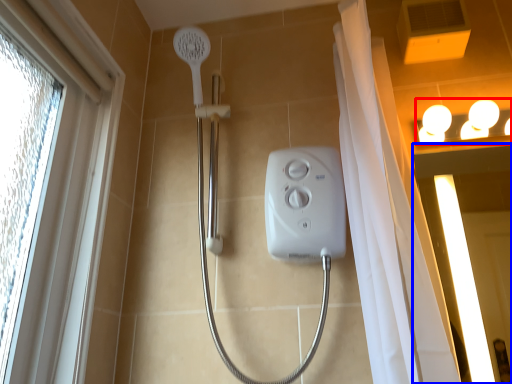
Question: Among these objects, which one is farthest to the camera, light fixture (highlighted by a red box) or screen door (highlighted by a blue box)?

Choices:
 (A) light fixture
 (B) screen door

Answer: (A)